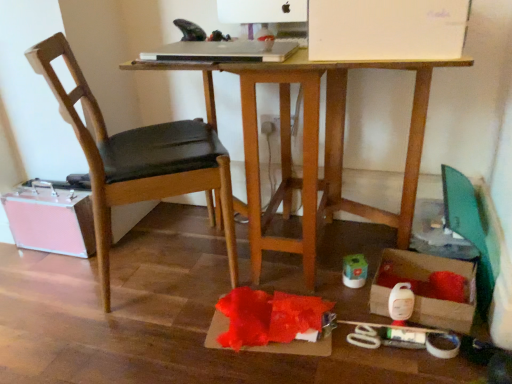
Identify the location of blank space to the left of black leather chair at left. This screenshot has height=384, width=512. (48, 291).